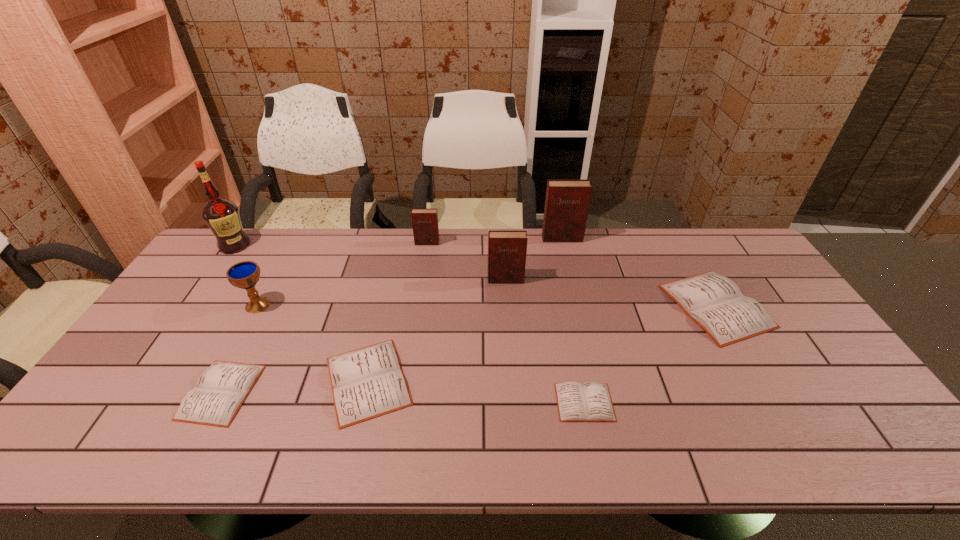
In order to click on diary that is the closest to the leftmost reddish-brown diary in this screenshot , I will do `click(507, 250)`.

Identify which reddish-brown diary is the closest to the leftmost white diary. Please provide its 2D coordinates. Your answer should be formatted as a tuple, i.e. [(x, y)], where the tuple contains the x and y coordinates of a point satisfying the conditions above.

[(424, 221)]

The image size is (960, 540). Find the location of `reddish-brown diary that is the closest one to the fifth tallest diary`. reddish-brown diary that is the closest one to the fifth tallest diary is located at coordinates (507, 250).

Locate an element on the screen. The width and height of the screenshot is (960, 540). white diary that can be found as the closest to the fourth object from right to left is located at coordinates (368, 382).

Locate which white diary is the second closest to the shortest object. Please provide its 2D coordinates. Your answer should be formatted as a tuple, i.e. [(x, y)], where the tuple contains the x and y coordinates of a point satisfying the conditions above.

[(368, 382)]

The width and height of the screenshot is (960, 540). Find the location of `vacant space that satisfies the following two spatial constraints: 1. on the front cover of the shortest object; 2. on the left side of the second reddish-brown diary from left to right`. vacant space that satisfies the following two spatial constraints: 1. on the front cover of the shortest object; 2. on the left side of the second reddish-brown diary from left to right is located at coordinates (514, 402).

You are a GUI agent. You are given a task and a screenshot of the screen. Output one action in this format:
    pyautogui.click(x=<x>, y=<y>)
    Task: Click on the blank space that satisfies the following two spatial constraints: 1. on the label of the tallest object; 2. on the left side of the chalice
    
    Given the screenshot: What is the action you would take?
    pyautogui.click(x=193, y=305)

Locate an element on the screen. free space that satisfies the following two spatial constraints: 1. on the label of the leftmost object; 2. on the left side of the seventh tallest object is located at coordinates (141, 381).

Locate an element on the screen. This screenshot has width=960, height=540. blank space that satisfies the following two spatial constraints: 1. on the label of the second shortest diary; 2. on the left side of the tallest object is located at coordinates (132, 392).